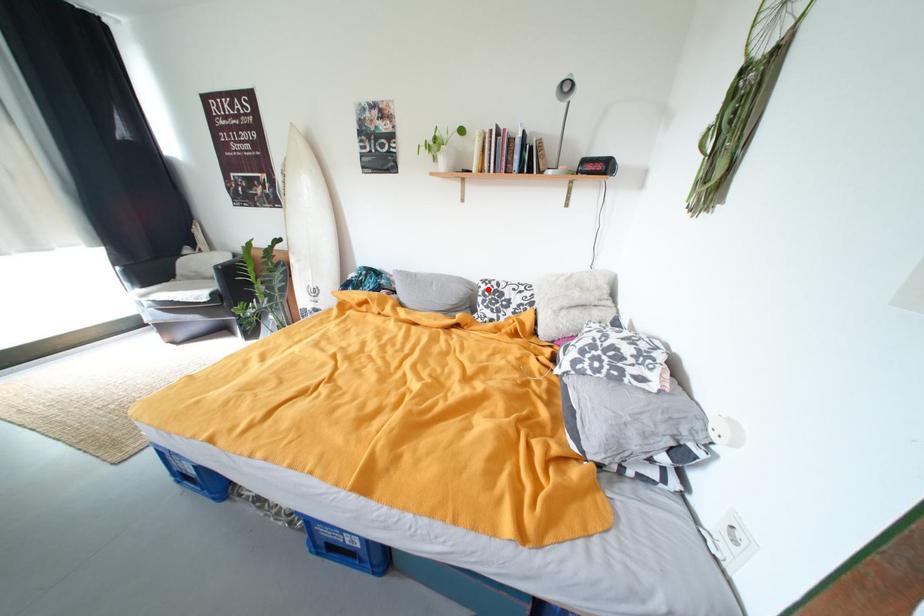
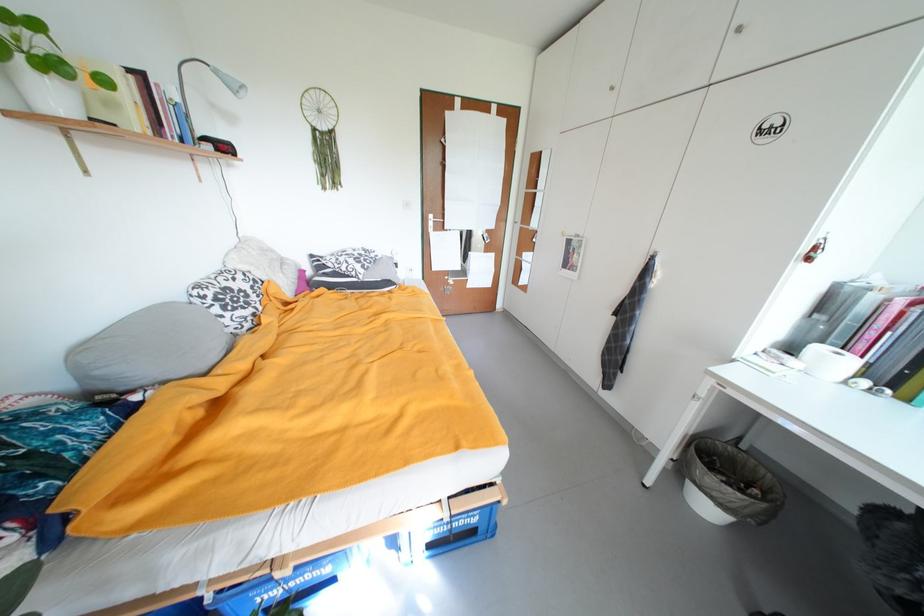
Locate, in the second image, the point that corresponds to the highlighted location in the first image.

(211, 299)